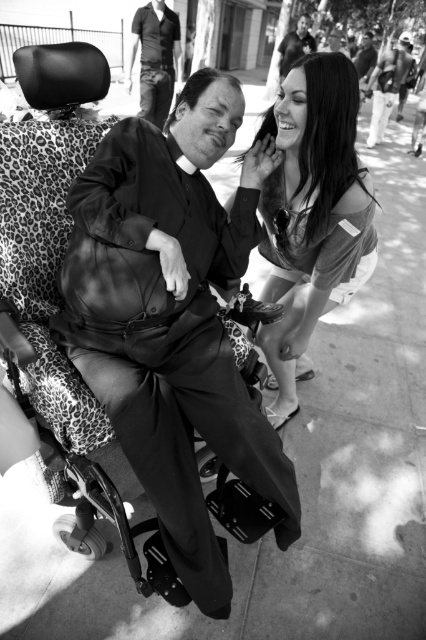
From the picture: Who is shorter, matte black suit at center or dark gray shirt at upper left?

dark gray shirt at upper left is shorter.

How distant is matte black suit at center from dark gray shirt at upper left?

matte black suit at center and dark gray shirt at upper left are 15.81 feet apart from each other.

Is point (166, 465) positioned before point (149, 10)?

Yes, it is in front of point (149, 10).

I want to click on matte black suit at center, so click(172, 317).

Who is shorter, matte black suit at center or smooth leather jacket at upper center?

With less height is smooth leather jacket at upper center.

Does matte black suit at center appear on the right side of smooth leather jacket at upper center?

No, matte black suit at center is not to the right of smooth leather jacket at upper center.

Does point (140, 342) lie behind point (299, 42)?

No, it is not.

Identify the location of matte black suit at center. This screenshot has width=426, height=640. [172, 317].

Consider the image. Can you confirm if dark gray shirt at upper left is taller than smooth leather jacket at upper center?

Yes, dark gray shirt at upper left is taller than smooth leather jacket at upper center.

Which is behind, point (164, 109) or point (284, 61)?

Point (284, 61)

What do you see at coordinates (155, 58) in the screenshot? The height and width of the screenshot is (640, 426). I see `dark gray shirt at upper left` at bounding box center [155, 58].

I want to click on dark gray shirt at upper left, so click(155, 58).